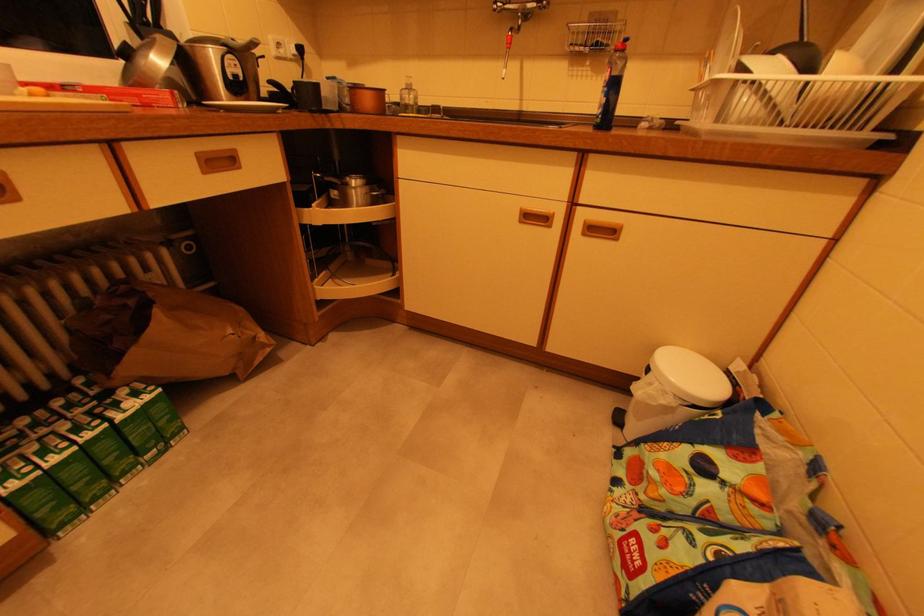
Locate an element on the screen. white plastic lid is located at coordinates pos(689,377).